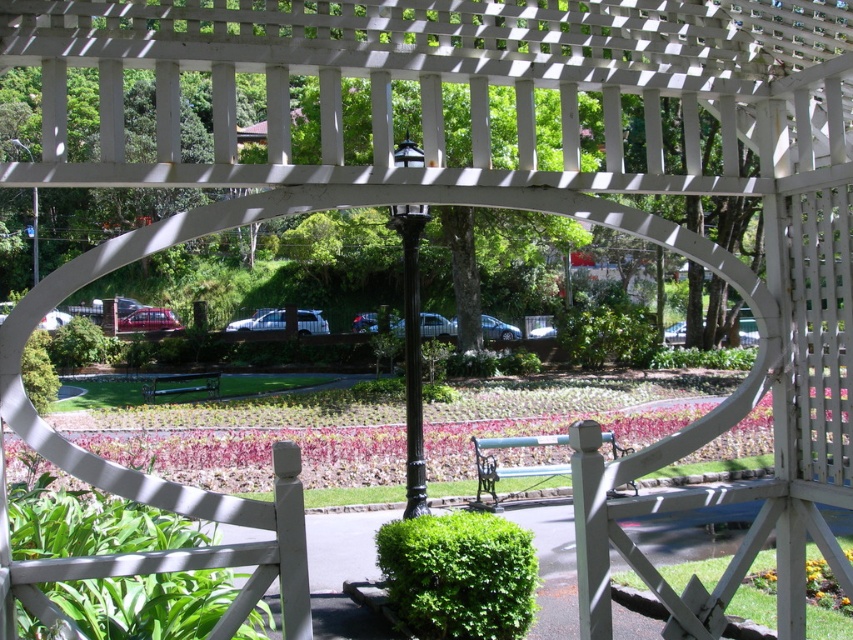
Question: Which point appears closest to the camera in this image?

Choices:
 (A) (535, 461)
 (B) (485, 477)

Answer: (B)

Question: Is pink matte flower at center behind green painted wood bench at center?

Choices:
 (A) no
 (B) yes

Answer: (A)

Question: Which of the following is the farthest from the observer?

Choices:
 (A) pink matte flower at center
 (B) green painted wood bench at center

Answer: (B)

Question: Which of the following is the closest to the observer?

Choices:
 (A) pink matte flower at center
 (B) green painted wood bench at center

Answer: (A)

Question: Is the position of pink matte flower at center less distant than that of green wooden bench at center?

Choices:
 (A) yes
 (B) no

Answer: (A)

Question: Is pink matte flower at center further to the viewer compared to green wooden bench at center?

Choices:
 (A) yes
 (B) no

Answer: (B)